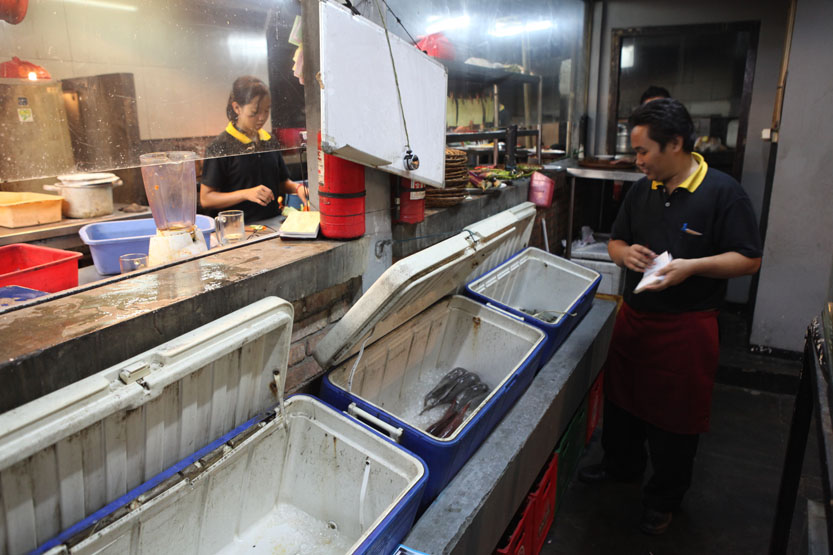
At what (x,y) coordinates should I click in order to perform the action: click on notepad. Please return your answer as a coordinate pair (x, y). The height and width of the screenshot is (555, 833). Looking at the image, I should click on click(654, 275).